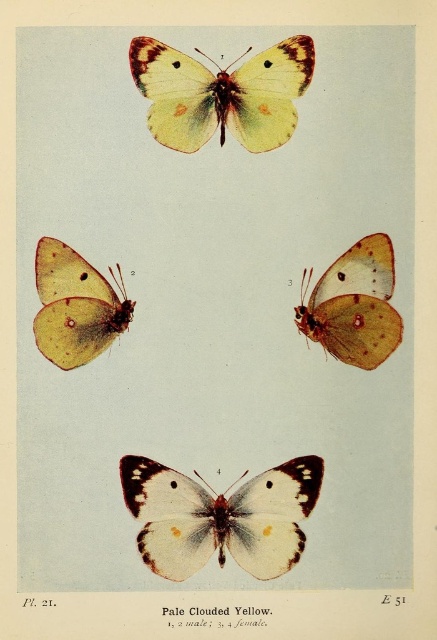
You are an entomologist examining the scientific illustration of butterflies. You notice two matte yellow butterflies in the upper sections of the image. Specifically, there is a matte yellow butterfly at upper center and a matte yellow butterfly at upper left. Based on their positions, which one is located to the right of the other?

The matte yellow butterfly at upper center is positioned on the right side of the matte yellow butterfly at upper left.

You are examining a scientific illustration of butterflies divided into four quadrants. You notice a pale clouded yellow at center in the image. Based on its position, can you determine which quadrant it is located in?

The pale clouded yellow at center is located in the bottom left quadrant because its 2D coordinates at point (221, 516) place it in that section of the image.